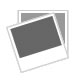
Find the location of a particular element. The width and height of the screenshot is (80, 80). poloroid pictures is located at coordinates (25, 14), (31, 37).